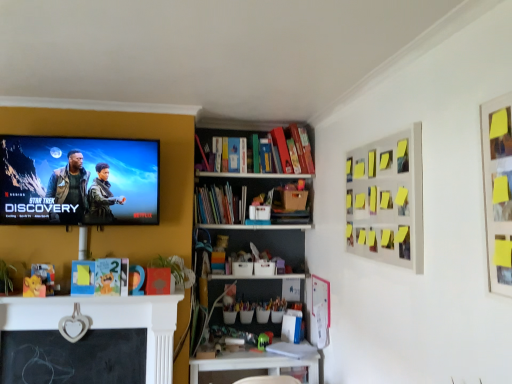
Where is `free space in front of green plastic toy at lower center`? The width and height of the screenshot is (512, 384). free space in front of green plastic toy at lower center is located at coordinates (261, 355).